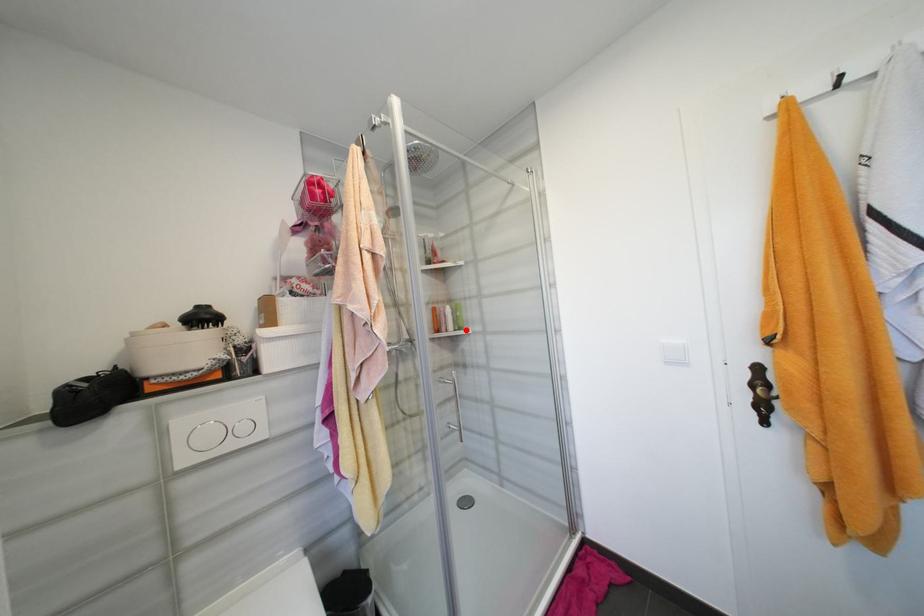
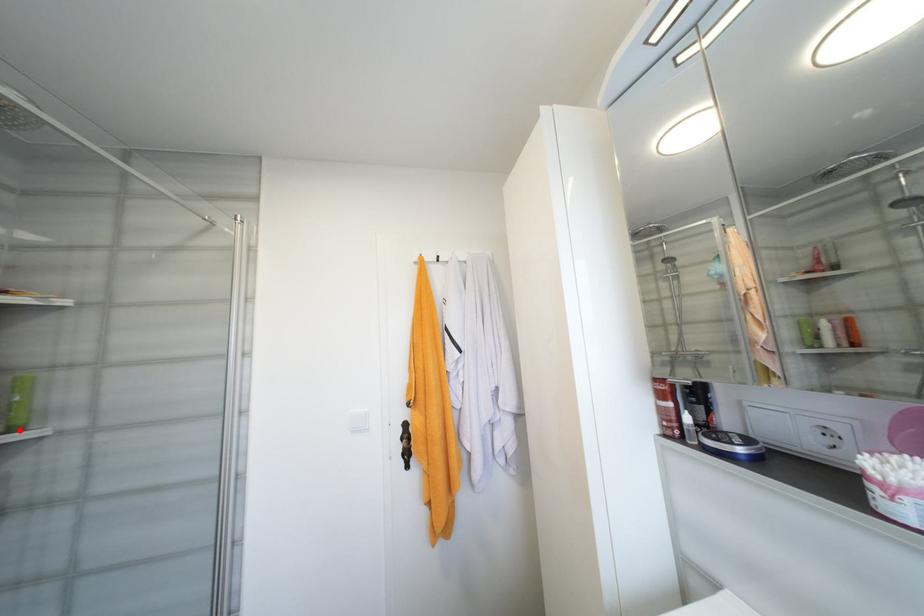
I am providing you with two images of the same scene from different viewpoints. A red point is marked on the first image and another point is marked on the second image. Do the highlighted points in image1 and image2 indicate the same real-world spot?

Yes